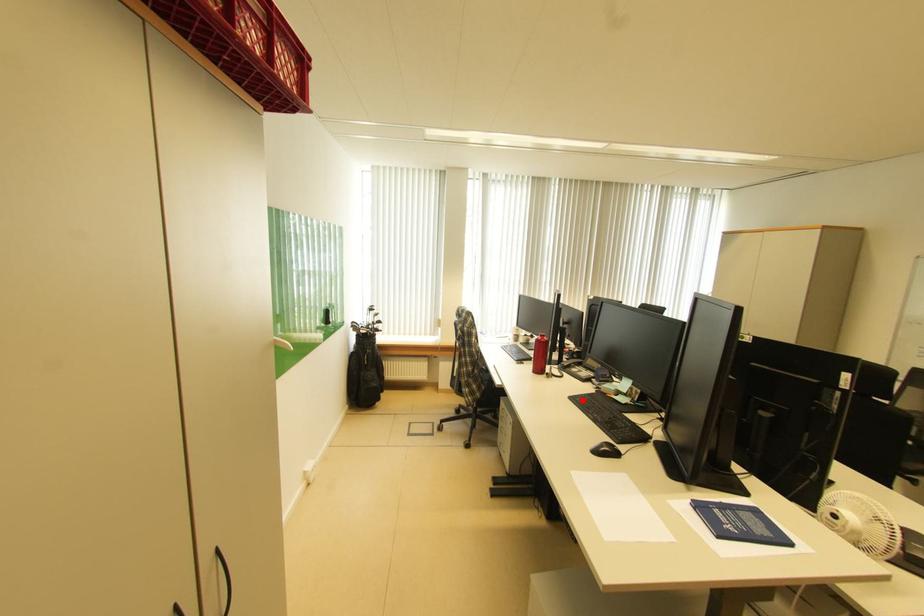
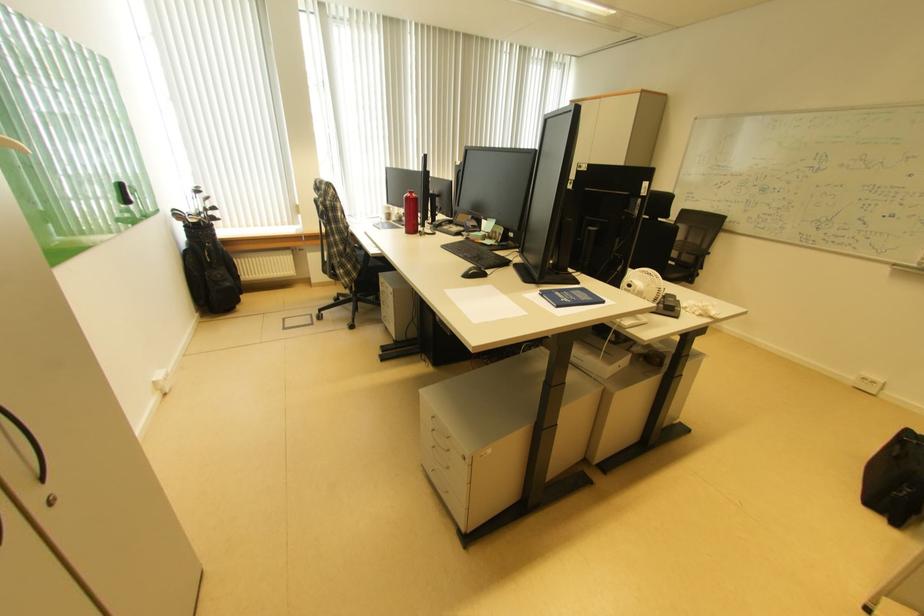
The point at the highlighted location is marked in the first image. Where is the corresponding point in the second image?

(455, 249)